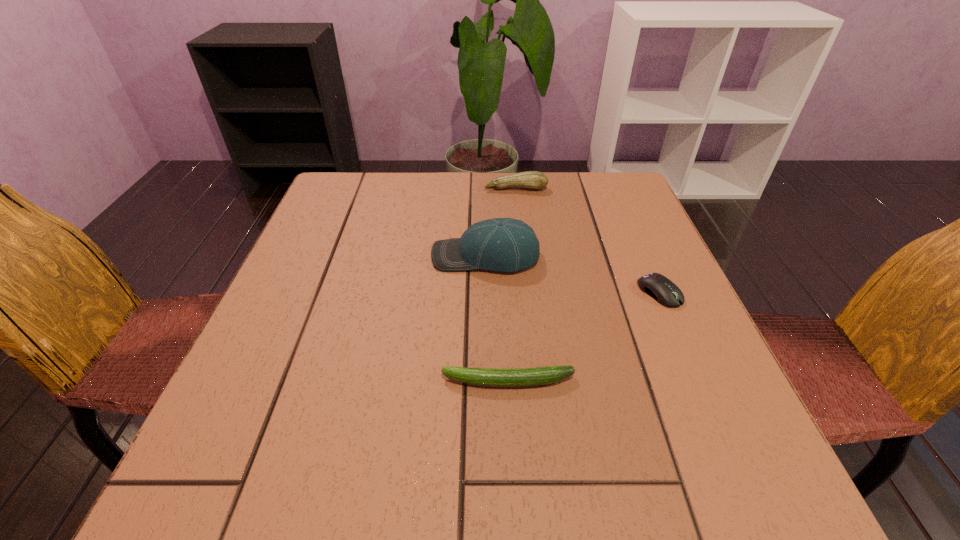
Find the location of `blank area located 0.190m on the left of the computer equipment`. blank area located 0.190m on the left of the computer equipment is located at coordinates (546, 292).

Identify the location of free space located 0.160m on the front-facing side of the nearest object. (346, 381).

This screenshot has height=540, width=960. Find the location of `free space located 0.090m on the front-facing side of the nearest object`. free space located 0.090m on the front-facing side of the nearest object is located at coordinates (388, 381).

Where is `vacant space located on the front-facing side of the nearest object`? Image resolution: width=960 pixels, height=540 pixels. vacant space located on the front-facing side of the nearest object is located at coordinates pyautogui.click(x=340, y=381).

Find the location of a particular element. object at the far edge is located at coordinates (536, 180).

Locate an element on the screen. The width and height of the screenshot is (960, 540). object present at the right edge is located at coordinates (664, 291).

In the image, there is a desktop. Identify the location of vacant space at the far edge. The image size is (960, 540). (397, 207).

In order to click on vacant space at the left edge in this screenshot , I will do `click(353, 281)`.

Locate an element on the screen. The image size is (960, 540). vacant space at the right edge of the desktop is located at coordinates (636, 305).

At what (x,y) coordinates should I click in order to perform the action: click on blank space at the far left corner. Please return your answer as a coordinate pair (x, y). Image resolution: width=960 pixels, height=540 pixels. Looking at the image, I should click on (351, 216).